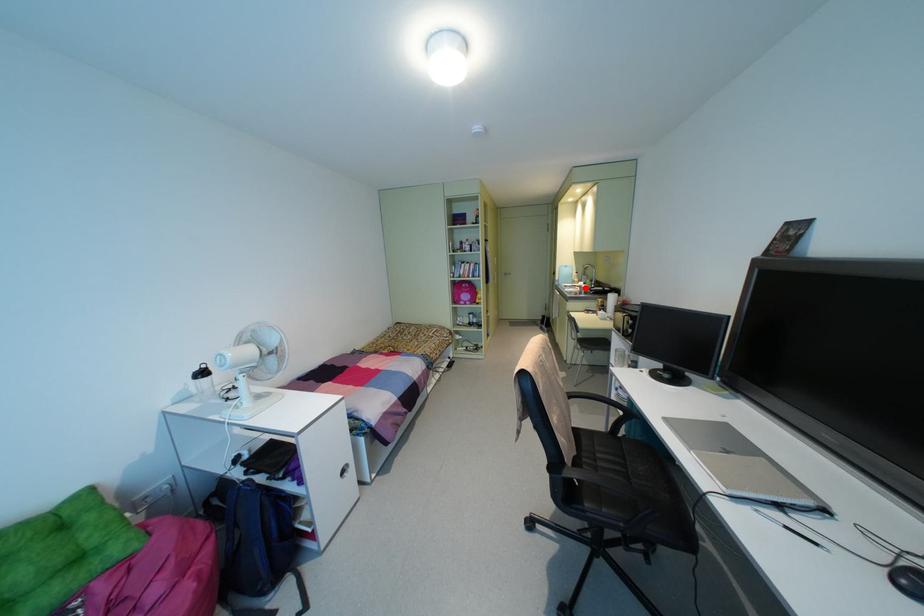
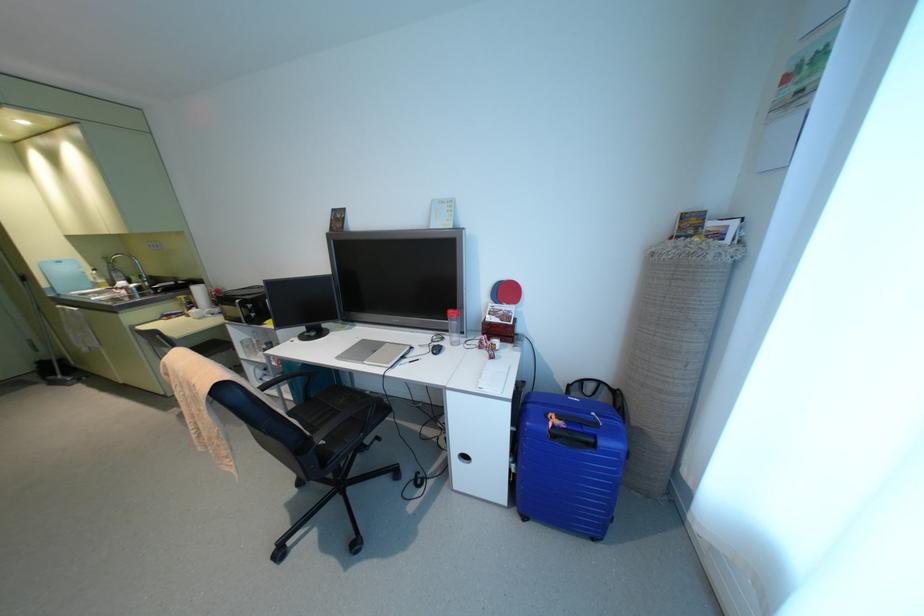
Locate, in the second image, the point that corresponds to the highlighted location in the first image.

(139, 288)